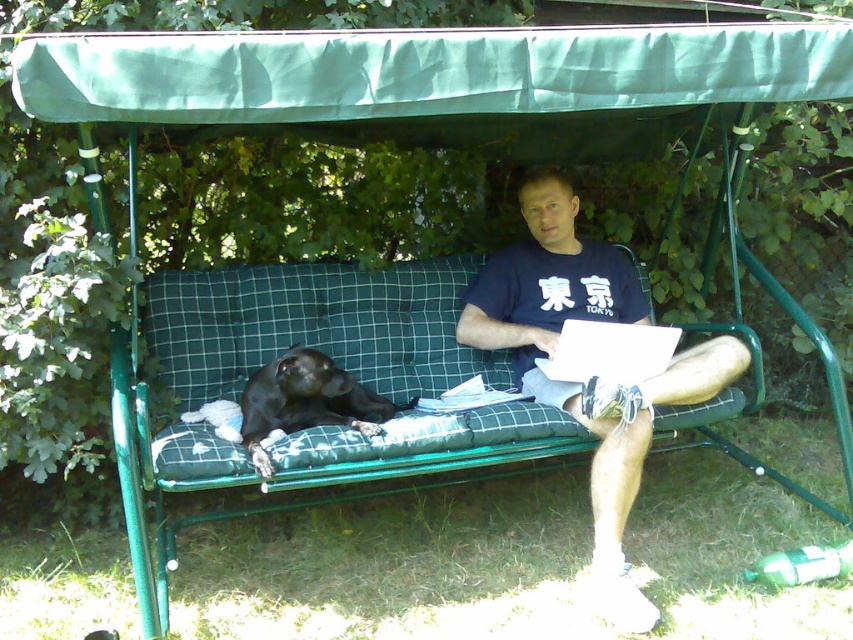
Is green fabric canopy at upper center below black fur dog at left?

No, green fabric canopy at upper center is not below black fur dog at left.

Measure the distance between green fabric canopy at upper center and camera.

green fabric canopy at upper center is 6.42 feet from camera.

Which is behind, point (416, 104) or point (381, 419)?

The point (381, 419) is behind.

The image size is (853, 640). I want to click on green fabric canopy at upper center, so point(424,72).

Which is more to the left, dark blue t-shirt at center or black fur dog at left?

black fur dog at left is more to the left.

Who is higher up, dark blue t-shirt at center or black fur dog at left?

dark blue t-shirt at center is higher up.

Where is `dark blue t-shirt at center`? This screenshot has height=640, width=853. dark blue t-shirt at center is located at coordinates click(x=589, y=380).

Is point (792, 93) in front of point (676, 356)?

Yes, point (792, 93) is closer to viewer.

Where is `green fabric canopy at upper center`? This screenshot has width=853, height=640. green fabric canopy at upper center is located at coordinates (424, 72).

You are a GUI agent. You are given a task and a screenshot of the screen. Output one action in this format:
    pyautogui.click(x=<x>, y=<y>)
    Task: Click on the green fabric canopy at upper center
    This screenshot has height=640, width=853.
    Given the screenshot: What is the action you would take?
    pyautogui.click(x=424, y=72)